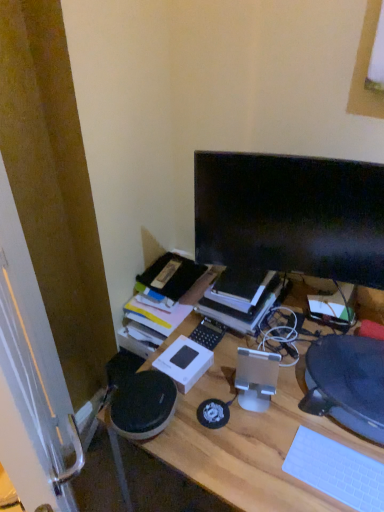
Question: Considering the positions of black textured computer chair at right and hardcover book at center in the image, is black textured computer chair at right taller or shorter than hardcover book at center?

Choices:
 (A) short
 (B) tall

Answer: (A)

Question: In the image, is black textured computer chair at right positioned in front of or behind hardcover book at center?

Choices:
 (A) front
 (B) behind

Answer: (A)

Question: Which object is positioned farthest from the black glossy monitor at upper right?

Choices:
 (A) white matte keyboard at lower right
 (B) wooden desk at center
 (C) black textured computer chair at right
 (D) hardcover book at center

Answer: (A)

Question: Which is farther from the hardcover book at center?

Choices:
 (A) black glossy monitor at upper right
 (B) wooden desk at center
 (C) white matte keyboard at lower right
 (D) black textured computer chair at right

Answer: (C)